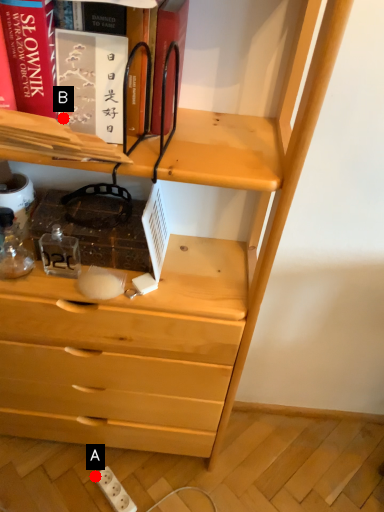
Question: Two points are circled on the image, labeled by A and B beside each circle. Among these points, which one is nearest to the camera?

Choices:
 (A) A is closer
 (B) B is closer

Answer: (B)